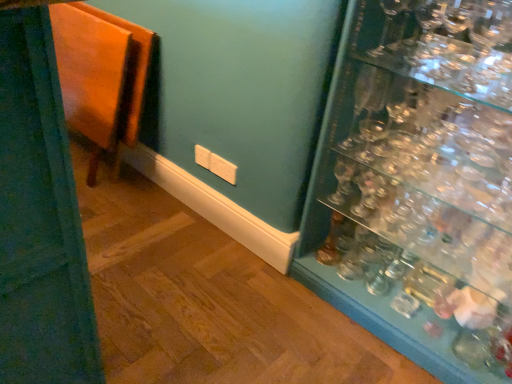
Question: Is transparent glass shelves at right inside the boundaries of clear glass wine glass at upper right, or outside?

Choices:
 (A) inside
 (B) outside

Answer: (B)

Question: Is transparent glass shelves at right bigger or smaller than clear glass wine glass at upper right?

Choices:
 (A) small
 (B) big

Answer: (B)

Question: Which object is the closest to the clear glass wine glass at upper right?

Choices:
 (A) transparent glass shelves at right
 (B) wooden folding table at left

Answer: (A)

Question: Which object is the farthest from the wooden folding table at left?

Choices:
 (A) clear glass wine glass at upper right
 (B) transparent glass shelves at right

Answer: (A)